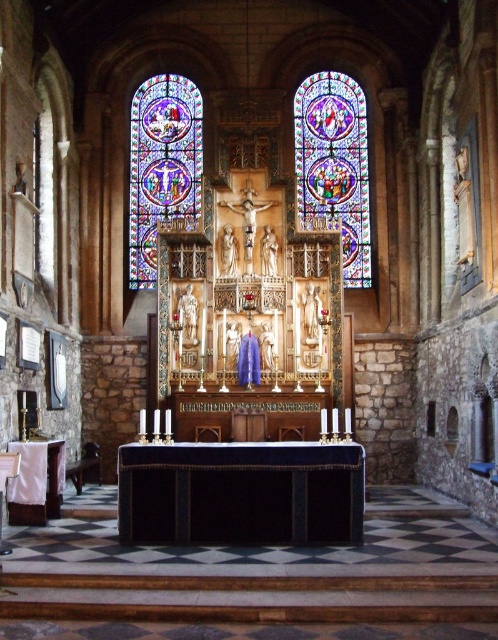
You are an architect analyzing the church layout. You need to determine which stained glass window is bigger between the stained glass window at center and the stained glass window at left. Based on the scene, which one is larger?

The stained glass window at center is larger in size than the stained glass window at left according to the description.

You are standing in the church and want to locate the stained glass window at center. According to the coordinates provided, where should you look relative to the altar?

The stained glass window at center is located at coordinates point (335,166), which is to the left and slightly below the altar.